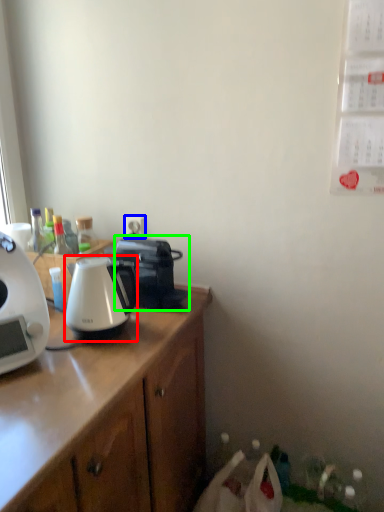
Question: Which is nearer to the kettle (highlighted by a red box)? power outlet (highlighted by a blue box) or coffee maker (highlighted by a green box).

Choices:
 (A) power outlet
 (B) coffee maker

Answer: (B)